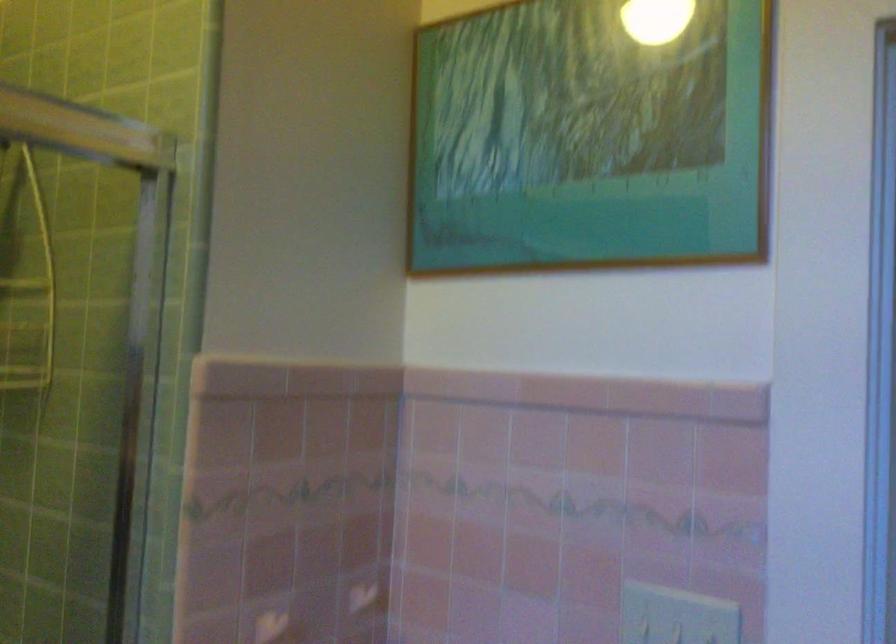
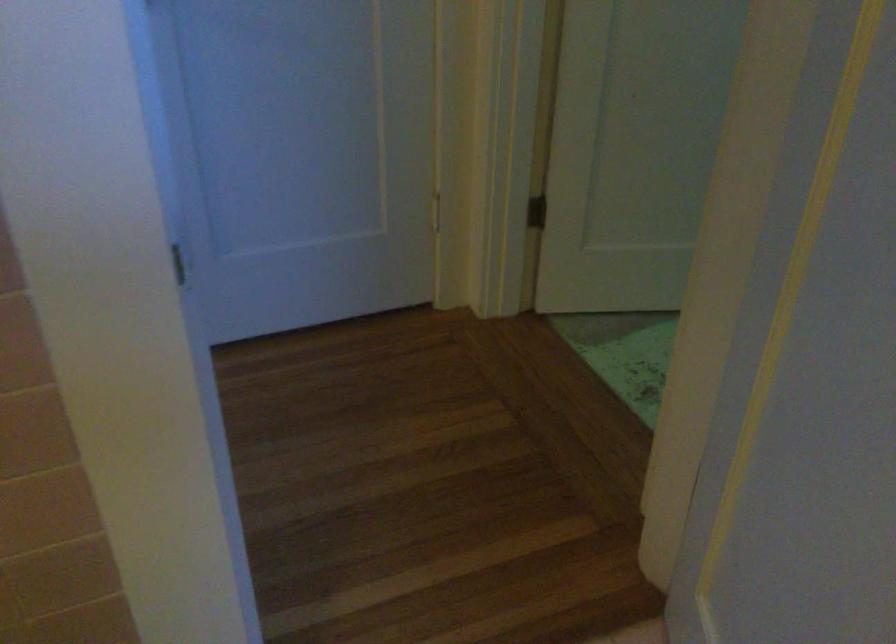
The images are taken continuously from a first-person perspective. In which direction is your viewpoint rotating?

The rotation direction of the camera is right-down.